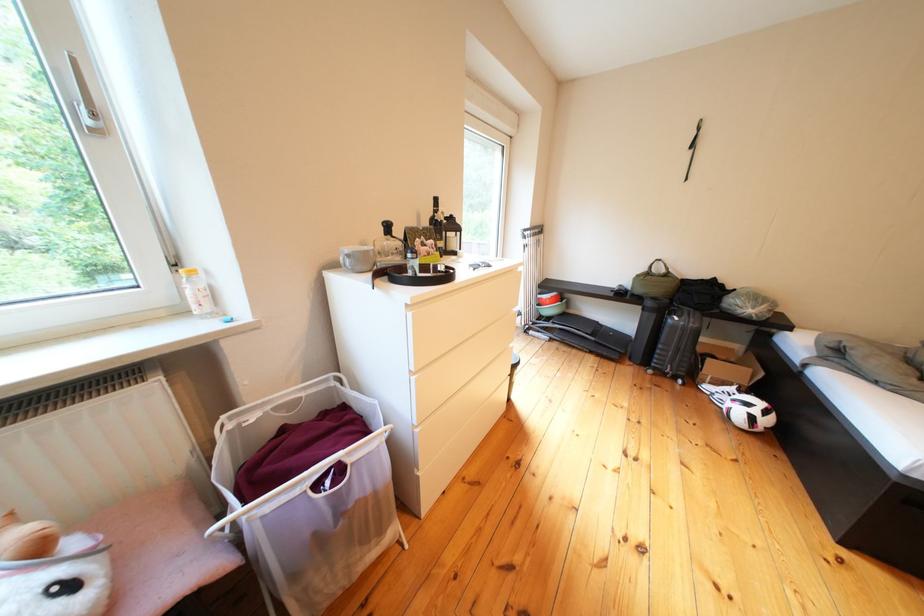
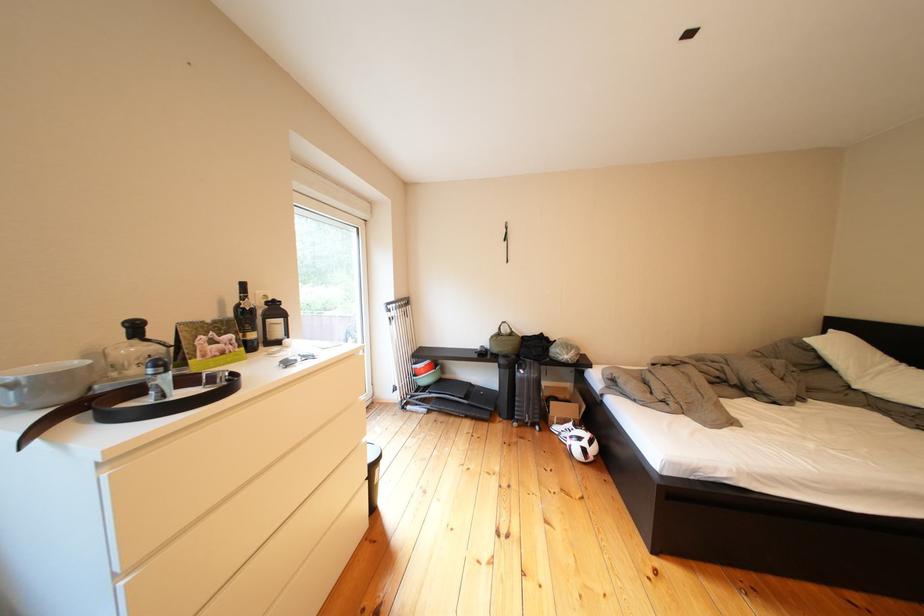
Find the pixel in the second image that matches point 526,350 in the first image.

(378, 445)